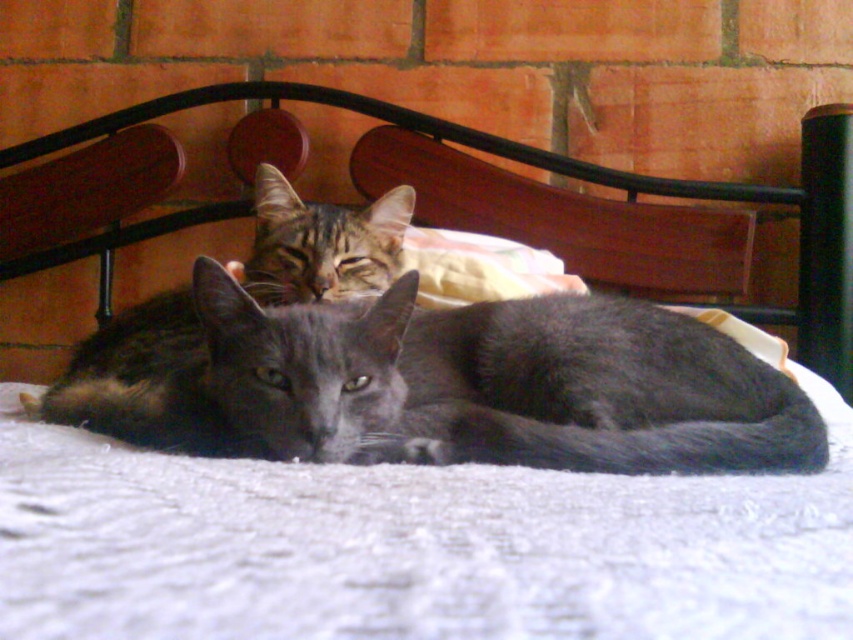
Based on the photo, does shiny gray cat at center appear on the left side of gray fur cat at center?

No, shiny gray cat at center is not to the left of gray fur cat at center.

Which is above, shiny gray cat at center or gray fur cat at center?

Positioned higher is gray fur cat at center.

Is point (614, 444) positioned after point (308, 204)?

No, it is in front of (308, 204).

Where is `shiny gray cat at center`? shiny gray cat at center is located at coordinates (502, 384).